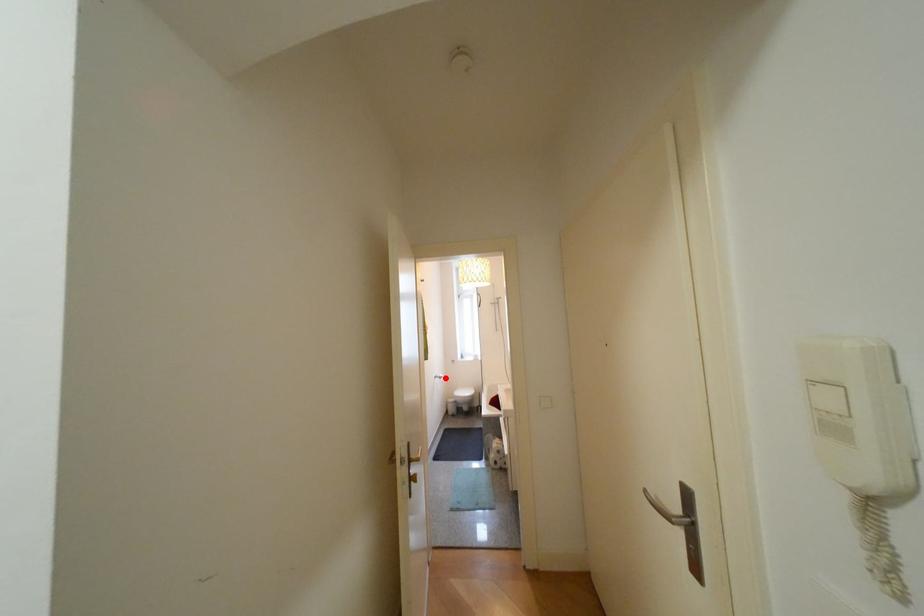
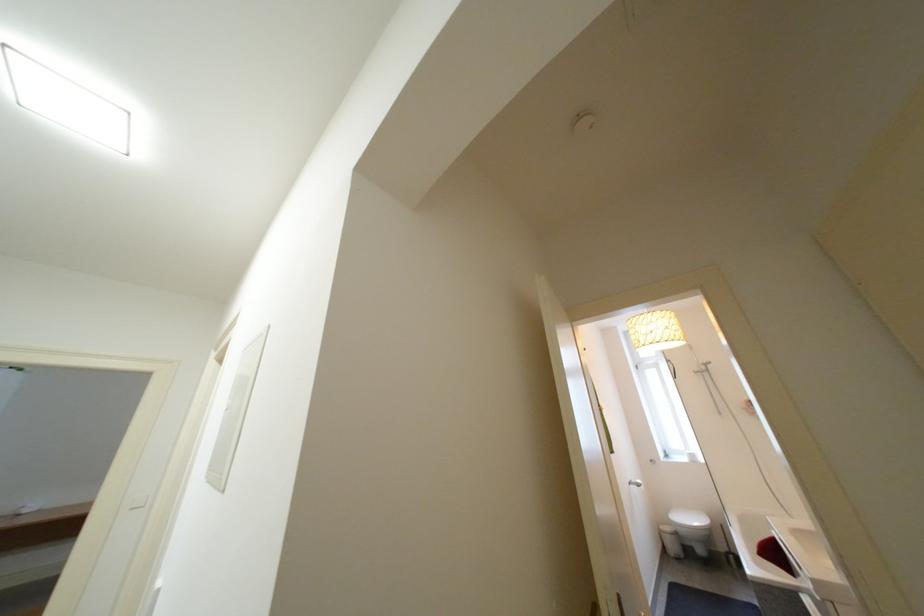
Question: I am providing you with two images of the same scene from different viewpoints. In image1, a red point is highlighted. Considering the same 3D point in image2, which of the following is correct?

Choices:
 (A) It is closer
 (B) It is farther

Answer: (B)